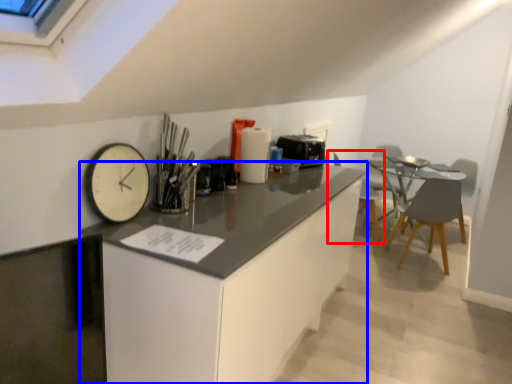
Question: Which of the following is the closest to the observer, chair (highlighted by a red box) or cabinetry (highlighted by a blue box)?

Choices:
 (A) chair
 (B) cabinetry

Answer: (B)